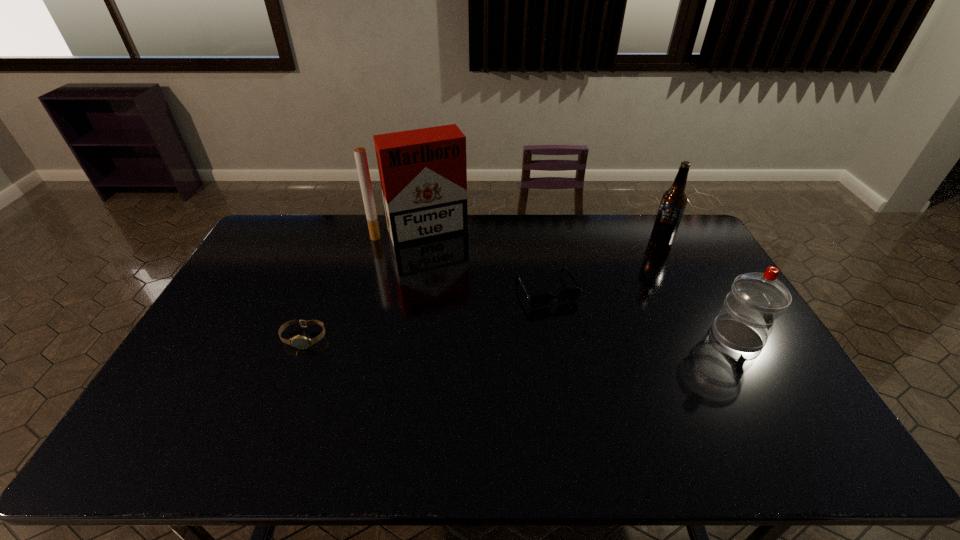
Find the location of a particular element. vacant space on the desktop that is between the watch and the third shortest object and is positioned on the front-facing side of the tallest object is located at coordinates (468, 337).

This screenshot has height=540, width=960. I want to click on free spot on the desktop that is between the leftmost object and the third shortest object and is positioned on the front-facing side of the third nearest object, so click(x=573, y=336).

Where is `vacant space on the desktop that is between the leftmost object and the third shortest object and is positioned on the label of the beer bottle`? vacant space on the desktop that is between the leftmost object and the third shortest object and is positioned on the label of the beer bottle is located at coordinates (578, 336).